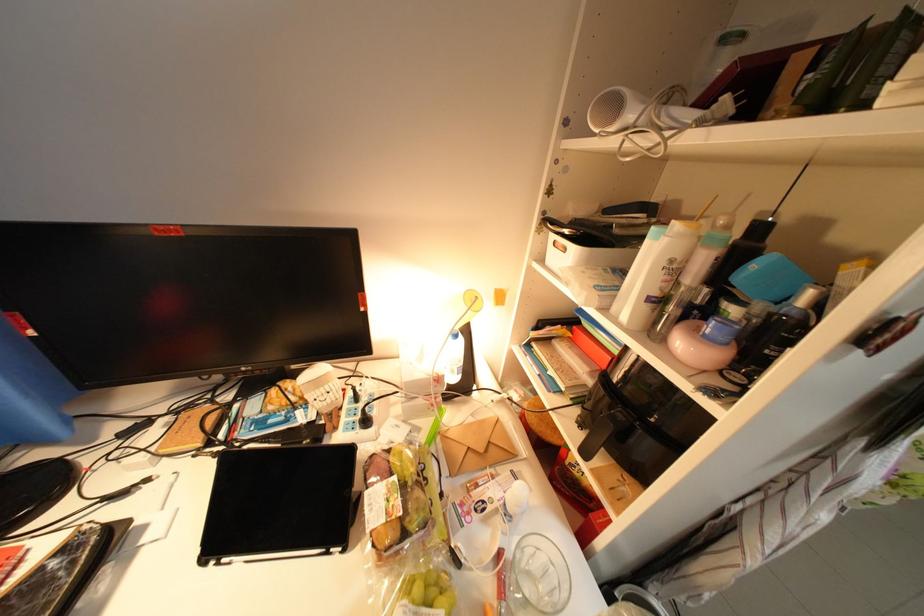
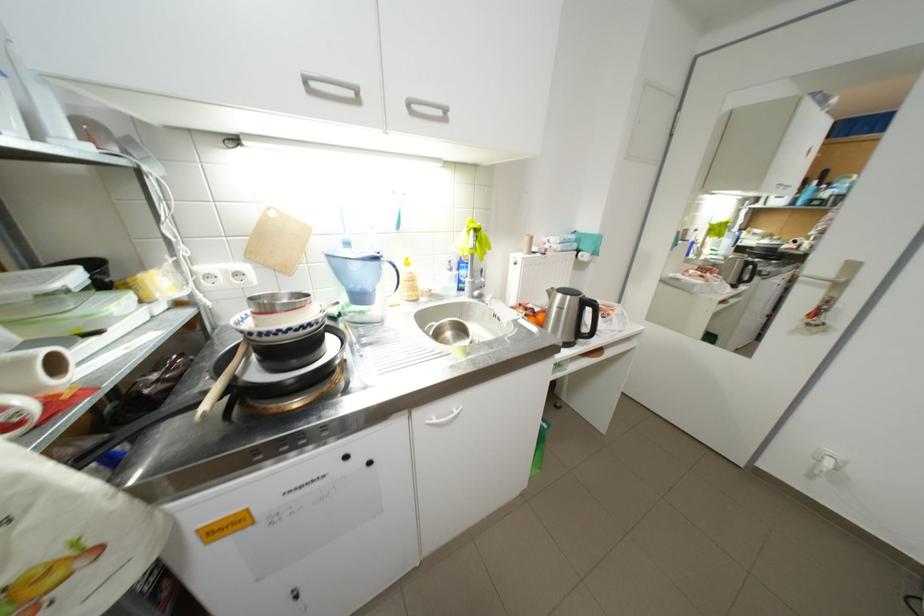
Question: The images are taken continuously from a first-person perspective. In which direction are you moving?

Choices:
 (A) Left
 (B) Right
 (C) Forward
 (D) Backward

Answer: (B)